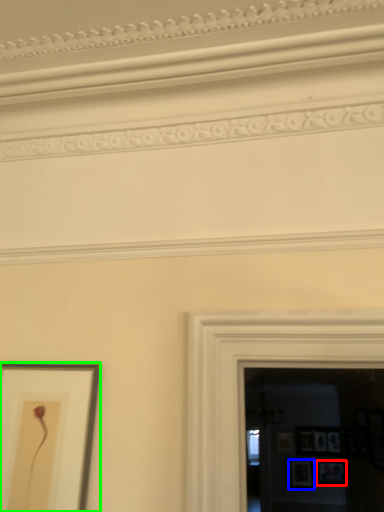
Question: Considering the real-world distances, which object is closest to picture frame (highlighted by a red box)? picture frame (highlighted by a blue box) or picture frame (highlighted by a green box).

Choices:
 (A) picture frame
 (B) picture frame

Answer: (A)